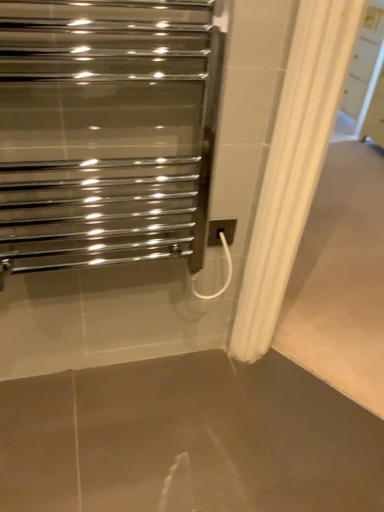
Question: Based on their sizes in the image, would you say brown polished concrete at center is bigger or smaller than white plastic electric outlet at center-right?

Choices:
 (A) big
 (B) small

Answer: (A)

Question: Based on their positions, is brown polished concrete at center located to the left or right of white plastic electric outlet at center-right?

Choices:
 (A) right
 (B) left

Answer: (A)

Question: Which of these objects is positioned closest to the white plastic electric outlet at center-right?

Choices:
 (A) polished chrome towel warmer at upper left
 (B) brown polished concrete at center

Answer: (A)

Question: Based on their relative distances, which object is nearer to the polished chrome towel warmer at upper left?

Choices:
 (A) brown polished concrete at center
 (B) white plastic electric outlet at center-right

Answer: (B)